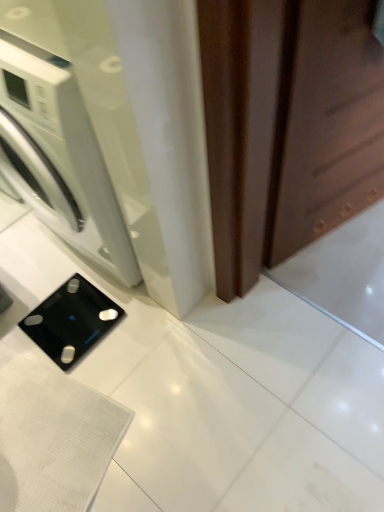
This screenshot has height=512, width=384. I want to click on black glass scale at lower left, so click(x=71, y=321).

Is brown matte screen door at right wider than black glass scale at lower left?

Incorrect, the width of brown matte screen door at right does not surpass that of black glass scale at lower left.

Visually, is brown matte screen door at right positioned to the left or to the right of black glass scale at lower left?

From the image, it's evident that brown matte screen door at right is to the right of black glass scale at lower left.

Which is closer to the camera, (361,9) or (107,317)?

The point (361,9) is more forward.

Is white glossy washing machine at left next to black glass scale at lower left and touching it?

No, white glossy washing machine at left is not next to black glass scale at lower left.

Where is `washing machine above the black glass scale at lower left (from a real-world perspective)`? This screenshot has height=512, width=384. washing machine above the black glass scale at lower left (from a real-world perspective) is located at coordinates (59, 157).

Based on the photo, which object is more forward, white glossy washing machine at left or black glass scale at lower left?

white glossy washing machine at left is more forward.

Is white glossy washing machine at left shorter than black glass scale at lower left?

In fact, white glossy washing machine at left may be taller than black glass scale at lower left.

Is black glass scale at lower left oriented towards white glossy washing machine at left?

No.

Which point is more forward, (67, 356) or (0, 160)?

The point (67, 356) is in front.

Considering the positions of objects black glass scale at lower left and white glossy washing machine at left in the image provided, who is more to the left, black glass scale at lower left or white glossy washing machine at left?

From the viewer's perspective, white glossy washing machine at left appears more on the left side.

Can white glossy washing machine at left be found inside black glass scale at lower left?

No, white glossy washing machine at left is not surrounded by black glass scale at lower left.

Looking at this image, which is more to the left, brown matte screen door at right or white glossy washing machine at left?

white glossy washing machine at left is more to the left.

Choose the correct answer: Is brown matte screen door at right inside white glossy washing machine at left or outside it?

The correct answer is: outside.

Is brown matte screen door at right taller or shorter than white glossy washing machine at left?

brown matte screen door at right is taller than white glossy washing machine at left.

Is brown matte screen door at right beside white glossy washing machine at left?

No, brown matte screen door at right is not in contact with white glossy washing machine at left.

Would you say white glossy washing machine at left is to the left or to the right of brown matte screen door at right in the picture?

white glossy washing machine at left is positioned on brown matte screen door at right's left side.

Which is behind, white glossy washing machine at left or brown matte screen door at right?

Positioned behind is white glossy washing machine at left.

At what (x,y) coordinates should I click in order to perform the action: click on washing machine on the left side of brown matte screen door at right. Please return your answer as a coordinate pair (x, y). Looking at the image, I should click on (59, 157).

Considering the sizes of white glossy washing machine at left and brown matte screen door at right in the image, is white glossy washing machine at left bigger or smaller than brown matte screen door at right?

In the image, white glossy washing machine at left appears to be larger than brown matte screen door at right.

How different are the orientations of black glass scale at lower left and brown matte screen door at right in degrees?

87.2 degrees separate the facing orientations of black glass scale at lower left and brown matte screen door at right.

Is black glass scale at lower left oriented away from brown matte screen door at right?

No, black glass scale at lower left's orientation is not away from brown matte screen door at right.

Can you confirm if black glass scale at lower left is bigger than brown matte screen door at right?

No.

Between black glass scale at lower left and brown matte screen door at right, which one has larger width?

Wider between the two is black glass scale at lower left.

Locate an element on the screen. screen door on the right of black glass scale at lower left is located at coordinates [x=325, y=123].

The image size is (384, 512). I want to click on appliance behind the white glossy washing machine at left, so click(71, 321).

Estimate the real-world distances between objects in this image. Which object is closer to white glossy washing machine at left, brown matte screen door at right or black glass scale at lower left?

black glass scale at lower left is closer to white glossy washing machine at left.

Estimate the real-world distances between objects in this image. Which object is further from black glass scale at lower left, white glossy washing machine at left or brown matte screen door at right?

Based on the image, brown matte screen door at right appears to be further to black glass scale at lower left.

In the scene shown: From the image, which object appears to be farther from black glass scale at lower left, brown matte screen door at right or white glossy washing machine at left?

brown matte screen door at right.

When comparing their distances from brown matte screen door at right, does black glass scale at lower left or white glossy washing machine at left seem further?

Among the two, black glass scale at lower left is located further to brown matte screen door at right.

Based on their spatial positions, is black glass scale at lower left or brown matte screen door at right further from white glossy washing machine at left?

brown matte screen door at right is further to white glossy washing machine at left.

Estimate the real-world distances between objects in this image. Which object is closer to brown matte screen door at right, white glossy washing machine at left or black glass scale at lower left?

Among the two, white glossy washing machine at left is located nearer to brown matte screen door at right.

The width and height of the screenshot is (384, 512). In order to click on appliance between white glossy washing machine at left and brown matte screen door at right in this screenshot , I will do `click(71, 321)`.